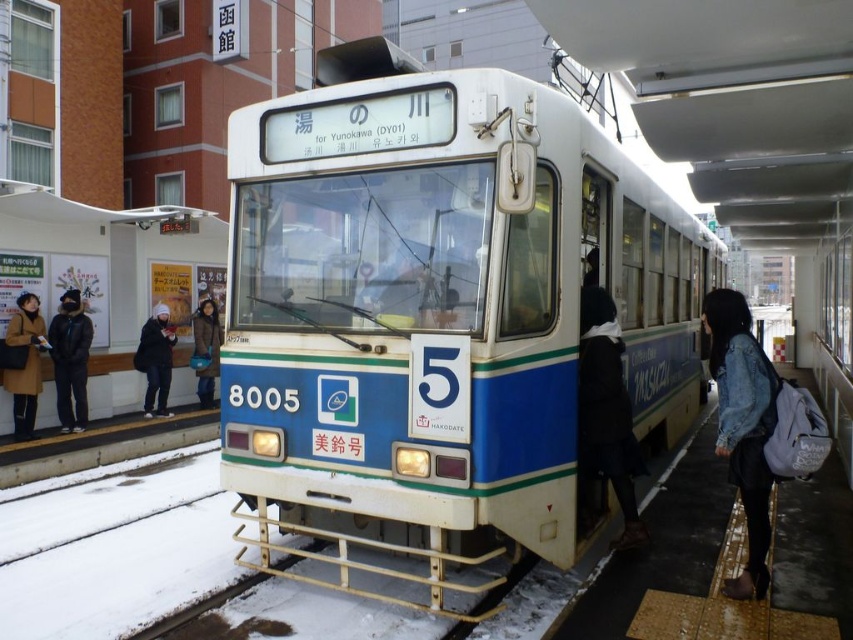
Based on the scene description, where is the blue matte train at center located in terms of coordinates?

The blue matte train at center is located at coordinates point (439, 312).

You are a passenger waiting at the tram station. You notice a blue matte train at center and a brown leather coat at left. Which object is wider?

The blue matte train at center is wider than the brown leather coat at left.

You are a delivery person with a package that is 2 meters wide. You need to carry it through the tram station. Can you pass between the blue matte train at center and the denim jacket at lower right without tilting the package?

The blue matte train at center might be wider than denim jacket at lower right, so there is uncertainty about the available space. To safely pass the 2 meter wide package, you should check the actual distance between them first before attempting to move the package through.